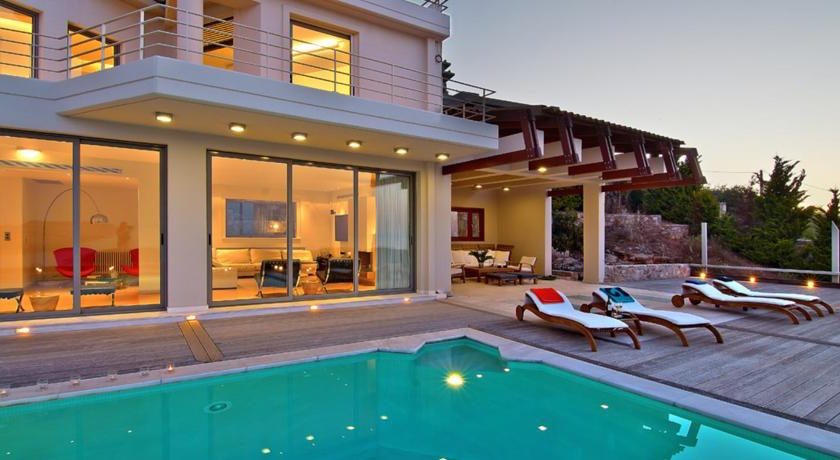
The height and width of the screenshot is (460, 840). In order to click on lower widnows in this screenshot , I will do `click(40, 273)`, `click(108, 256)`, `click(306, 244)`, `click(254, 267)`, `click(376, 250)`.